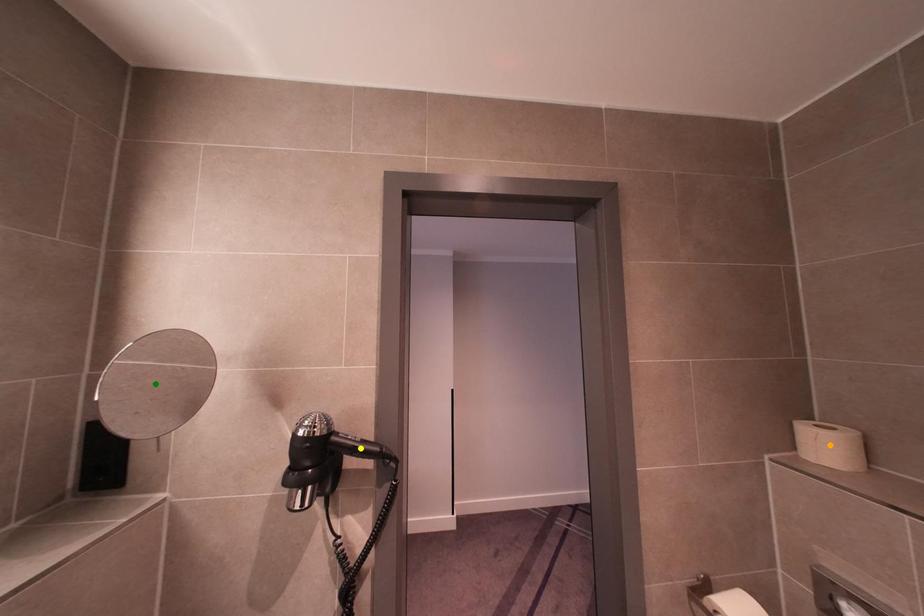
Order these from farthest to nearest:
green point
yellow point
orange point

orange point, yellow point, green point